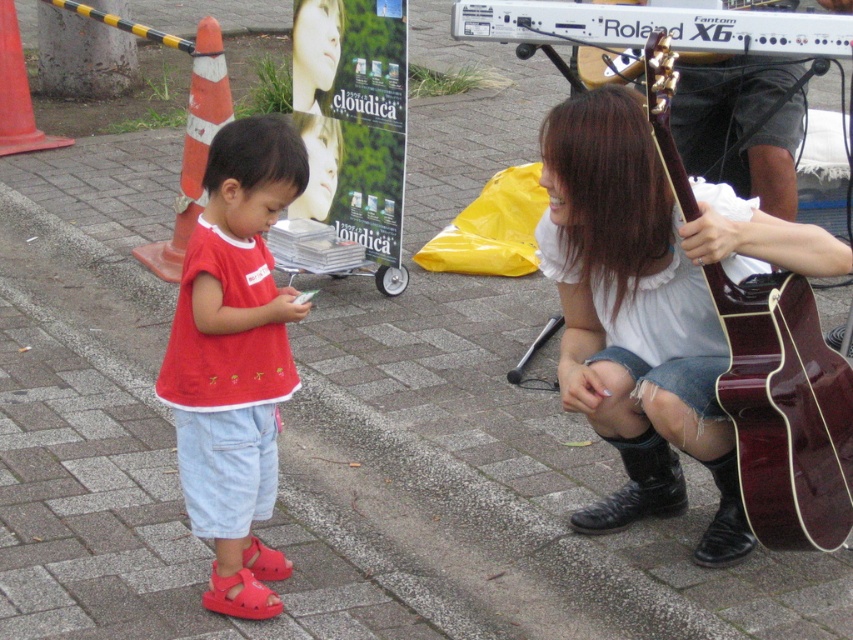
You are a photographer standing at the center of the scene. You want to take a photo that includes both the shiny dark wood guitar at lower right and the smooth skin face at upper center. Given that your camera has a maximum focus range of 9 feet, will you be able to capture both subjects in focus?

The shiny dark wood guitar at lower right and smooth skin face at upper center are 9.49 feet apart from each other. Since the distance between them exceeds the camera maximum focus range of 9 feet, the camera cannot focus on both subjects simultaneously.

You are a photographer setting up a tripod in this scene. You need to position the camera so that both the matte red sandals at lower left and the shiny dark wood guitar at lower right are visible in the frame. Considering their heights, which object might require you to adjust the camera angle downward more?

The matte red sandals at lower left has a lesser height compared to the shiny dark wood guitar at lower right, so you would need to adjust the camera angle downward more to include the matte red sandals at lower left in the frame.

You are a photographer setting up a tripod in the middle of the scene. You want to place the tripod so that it doesn not block either the matte red sandals at lower left or the shiny dark wood guitar at lower right. Given that the tripod has a base width of 30 cm, can you position it safely between them?

The matte red sandals at lower left is thinner than the shiny dark wood guitar at lower right. Since the tripod requires 30 cm of space, and the objects are positioned at lower left and lower right, there should be enough space between them to place the tripod without blocking either object.